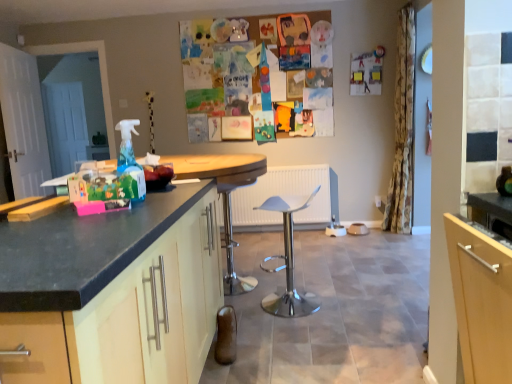
Locate an element on the screen. This screenshot has width=512, height=384. vacant area that is in front of white glossy swivel chair at center is located at coordinates (295, 331).